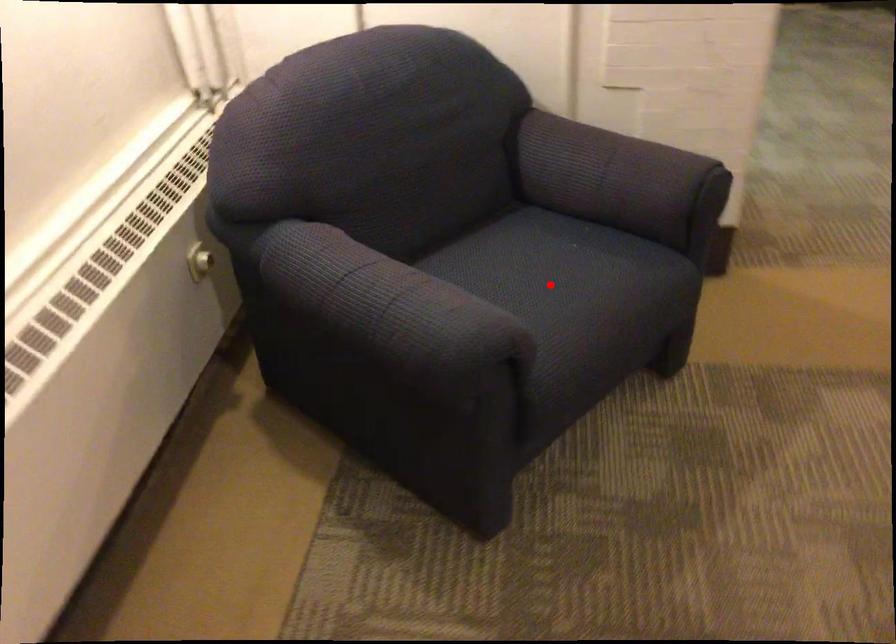
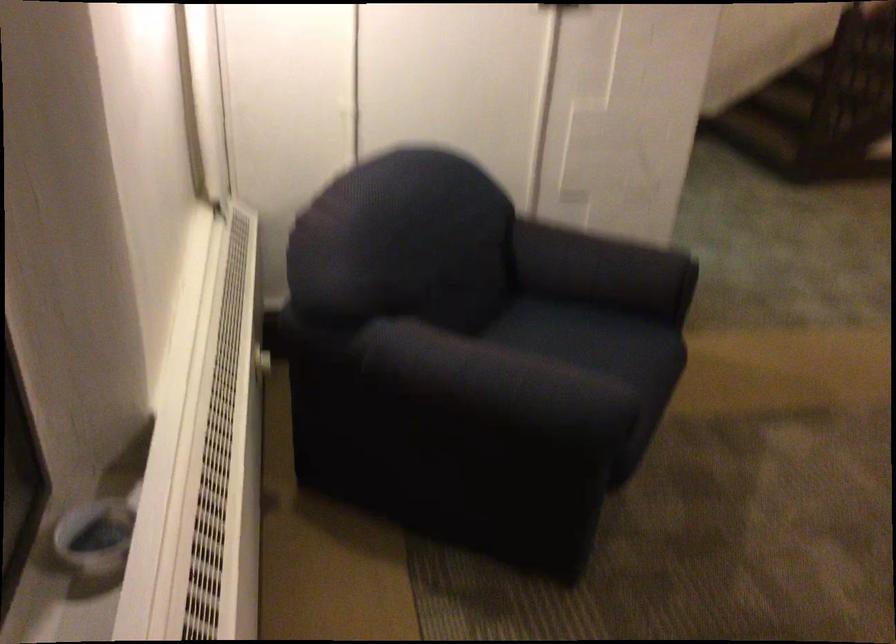
Question: I am providing you with two images of the same scene from different viewpoints. Image1 has a red point marked. In image2, the corresponding 3D location appears at what relative position? Reply with the corresponding letter.

Choices:
 (A) Closer
 (B) Farther

Answer: (B)